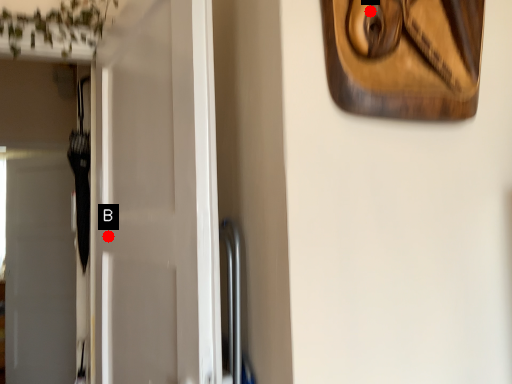
Question: Two points are circled on the image, labeled by A and B beside each circle. Which point is closer to the camera?

Choices:
 (A) A is closer
 (B) B is closer

Answer: (A)